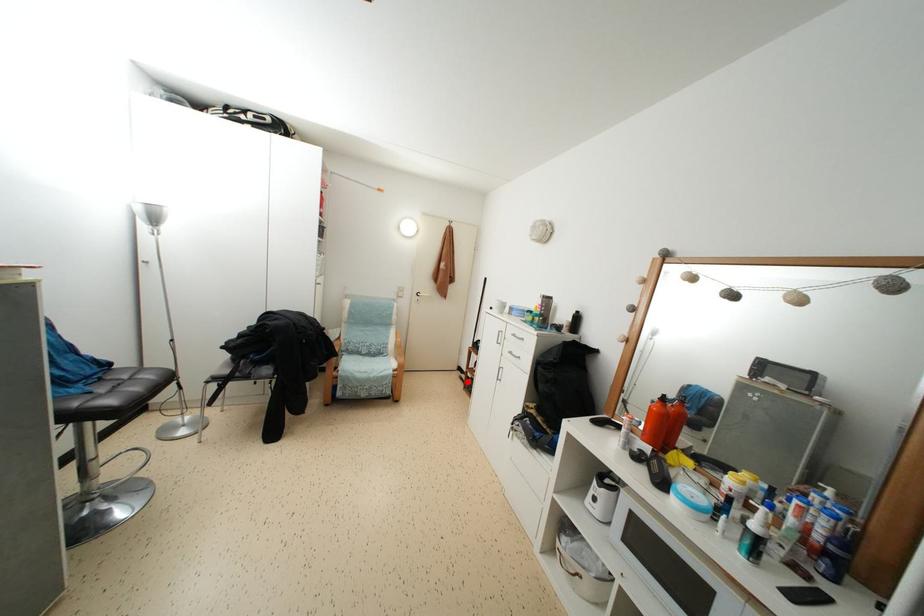
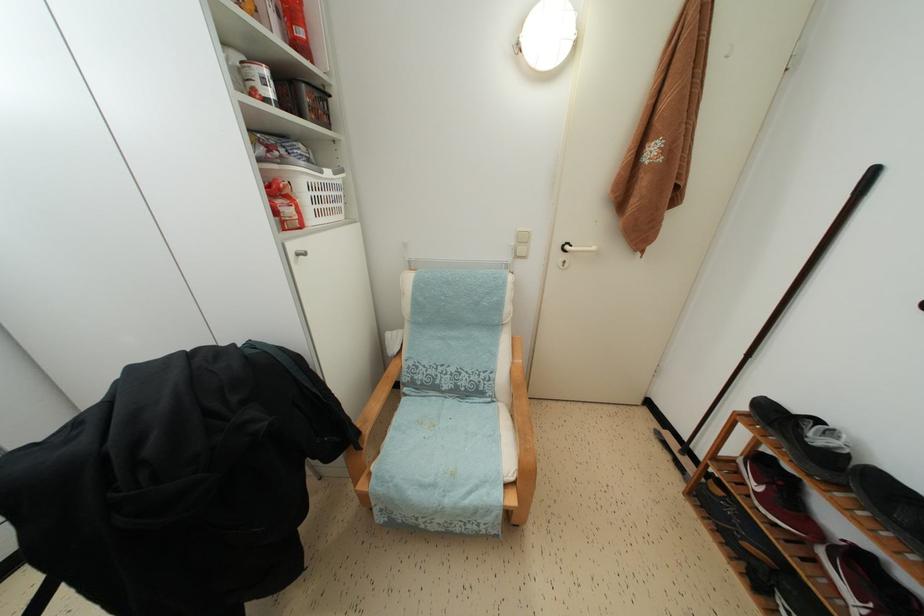
Question: I am providing you with two images of the same scene from different viewpoints. A red point is marked on the first image. Is the red point's position out of view in image 2?

Choices:
 (A) Yes
 (B) No

Answer: (B)